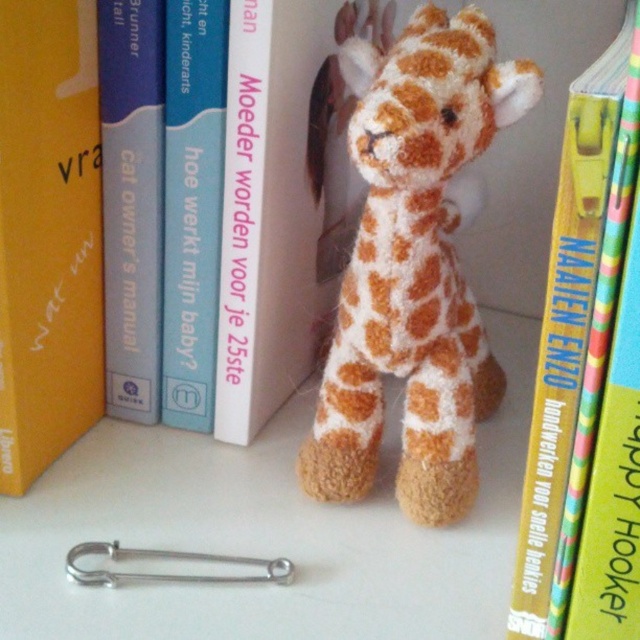
Question: Considering the relative positions of yellow matte book at upper left and yellow paperback book at center in the image provided, where is yellow matte book at upper left located with respect to yellow paperback book at center?

Choices:
 (A) above
 (B) below

Answer: (B)

Question: From the image, what is the correct spatial relationship of yellow paperback book at center in relation to blue paperback book at upper center?

Choices:
 (A) left
 (B) right

Answer: (B)

Question: Which point appears farthest from the camera in this image?

Choices:
 (A) (220, 44)
 (B) (380, 168)
 (C) (561, 300)
 (D) (109, 342)

Answer: (D)

Question: Considering the relative positions of yellow matte book at upper left and yellow paperback book at center in the image provided, where is yellow matte book at upper left located with respect to yellow paperback book at center?

Choices:
 (A) above
 (B) below

Answer: (B)

Question: Based on their relative distances, which object is farther from the fluffy orange and white plush giraffe at center?

Choices:
 (A) yellow matte book at upper left
 (B) blue paperback book at left
 (C) blue paperback book at upper center

Answer: (A)

Question: Among these objects, which one is farthest from the camera?

Choices:
 (A) fluffy orange and white plush giraffe at center
 (B) blue paperback book at left
 (C) blue paperback book at upper center
 (D) yellow matte book at upper left

Answer: (B)